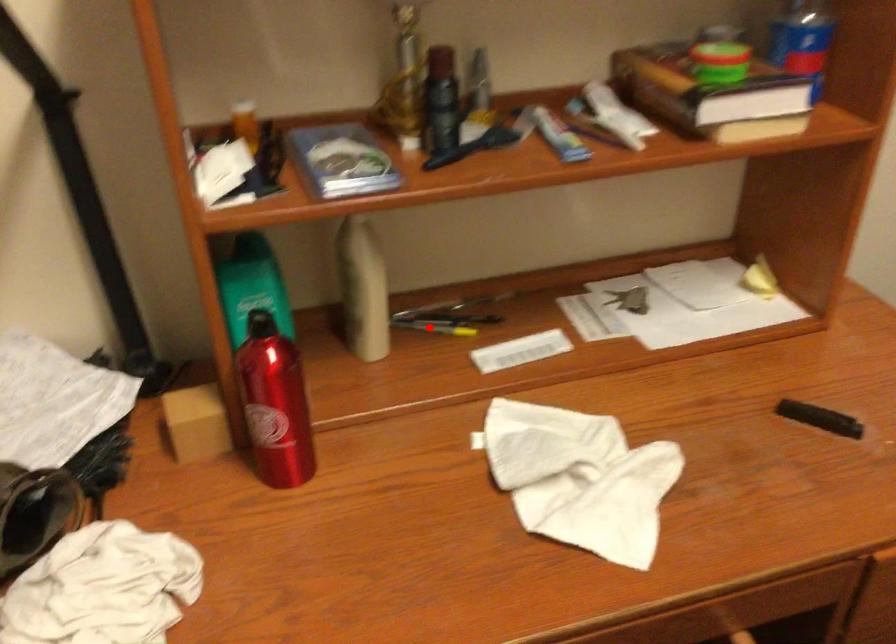
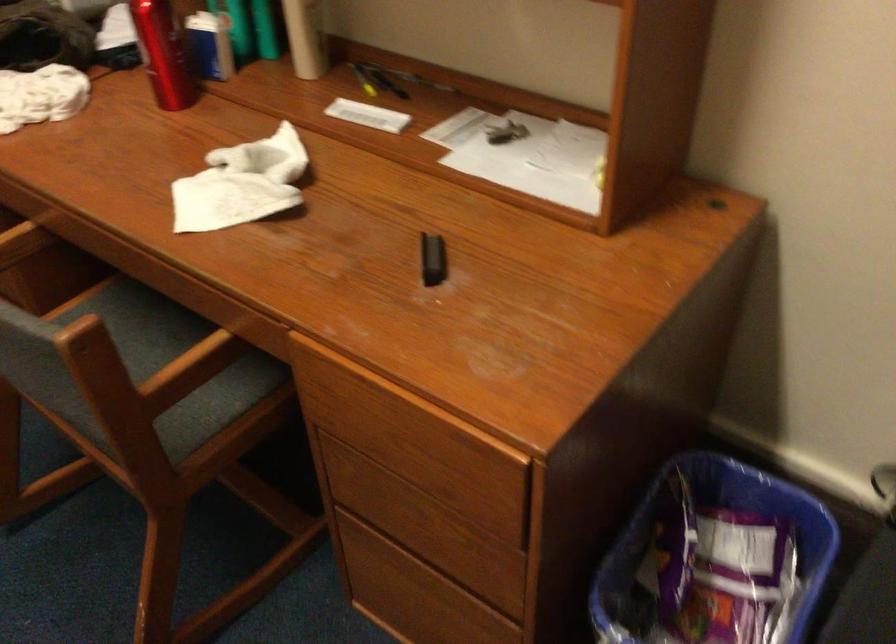
Question: I am providing you with two images of the same scene from different viewpoints. Image1 has a red point marked. In image2, the corresponding 3D location appears at what relative position? Reply with the corresponding letter.

Choices:
 (A) Closer
 (B) Farther

Answer: (B)